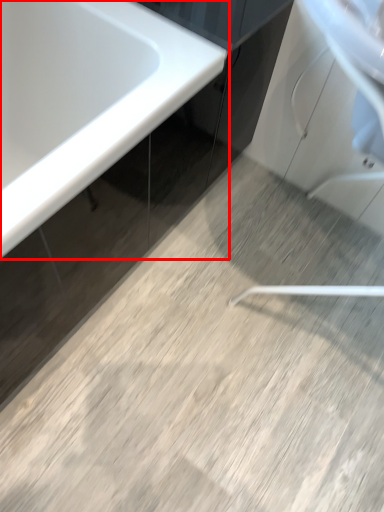
Question: From the image, what is the correct spatial relationship of bathtub (annotated by the red box) in relation to cabinetry?

Choices:
 (A) left
 (B) right

Answer: (A)